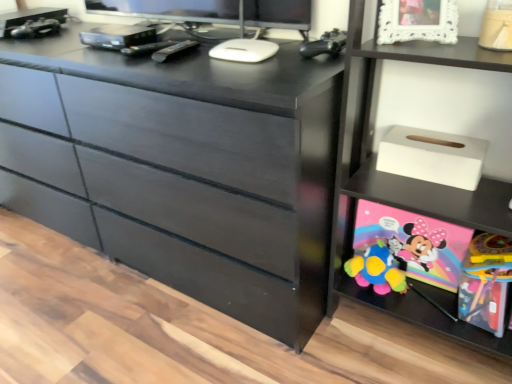
This screenshot has width=512, height=384. I want to click on free region on the left part of black plastic remote at center, so click(135, 55).